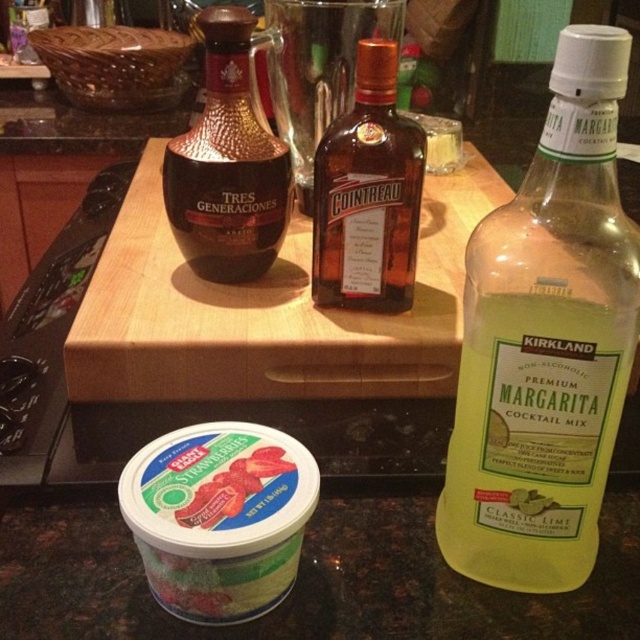
Between point (195, 228) and point (224, 472), which one is positioned in front?

Point (224, 472) is in front.

Which of these two, shiny brown glass bottle at center-left or green matte yogurt at lower left, stands taller?

shiny brown glass bottle at center-left is taller.

Where is `shiny brown glass bottle at center-left`? shiny brown glass bottle at center-left is located at coordinates (227, 164).

Can you confirm if brown glass bottle at center is positioned to the left of shiny brown glass bottle at center-left?

In fact, brown glass bottle at center is to the right of shiny brown glass bottle at center-left.

Is point (362, 180) farther from viewer compared to point (209, 216)?

No, it is in front of (209, 216).

Who is more forward, (x=385, y=176) or (x=230, y=276)?

Point (x=385, y=176) is more forward.

In order to click on brown glass bottle at center in this screenshot , I will do `click(368, 195)`.

Between point (404, 205) and point (189, 508), which one is positioned behind?

The point (404, 205) is behind.

Based on the photo, does brown glass bottle at center have a lesser width compared to green matte yogurt at lower left?

No, brown glass bottle at center is not thinner than green matte yogurt at lower left.

Who is more distant from viewer, (340, 262) or (240, 496)?

The point (340, 262) is behind.

Find the location of a particular element. The width and height of the screenshot is (640, 640). brown glass bottle at center is located at coordinates (368, 195).